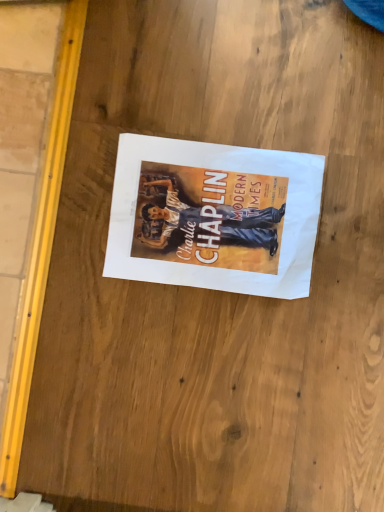
Locate an element on the screen. blank space situated above matte paper poster at center (from a real-world perspective) is located at coordinates (216, 215).